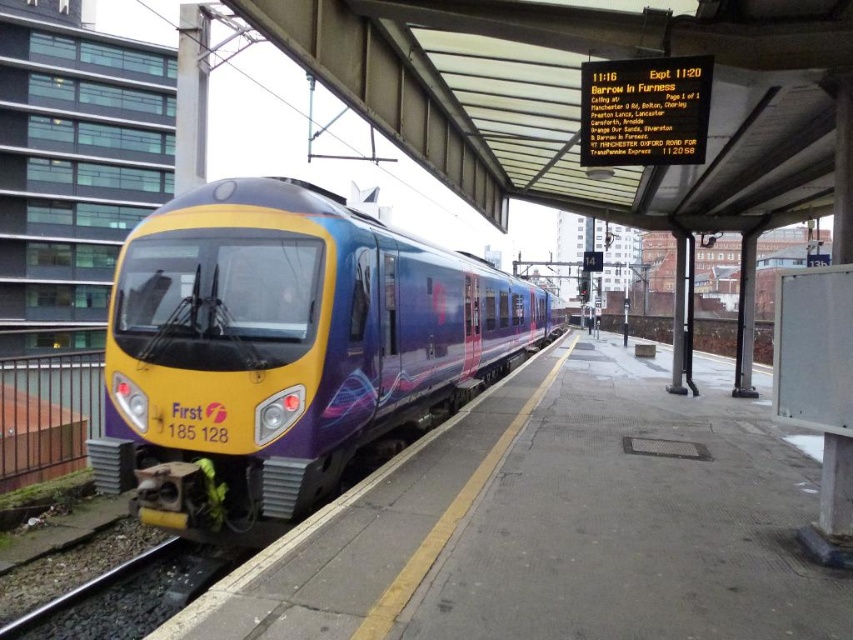
What do you see at coordinates (555, 525) in the screenshot?
I see `concrete platform at center` at bounding box center [555, 525].

Is concrete platform at center thinner than black gravel train track at lower left?

No.

Between point (593, 628) and point (154, 561), which one is positioned in front?

Point (593, 628) is more forward.

Where is `concrete platform at center`? concrete platform at center is located at coordinates (555, 525).

Between matte purple train at center and black gravel train track at lower left, which one is positioned lower?

black gravel train track at lower left is below.

Locate an element on the screen. This screenshot has height=640, width=853. matte purple train at center is located at coordinates (289, 352).

Is concrete platform at center closer to the viewer compared to matte purple train at center?

Yes, concrete platform at center is in front of matte purple train at center.

Between concrete platform at center and matte purple train at center, which one appears on the left side from the viewer's perspective?

Positioned to the left is matte purple train at center.

Between point (761, 547) and point (233, 502), which one is positioned in front?

Positioned in front is point (761, 547).

The image size is (853, 640). I want to click on concrete platform at center, so click(x=555, y=525).